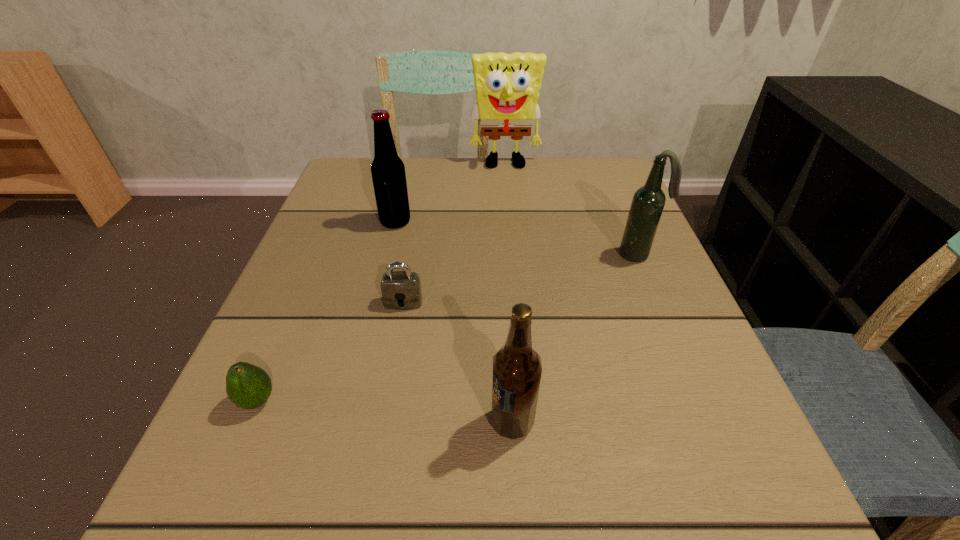
I want to click on empty space between the avocado and the nearest beer bottle, so click(x=385, y=411).

Where is `free point between the sponge and the second farthest beer bottle`? This screenshot has height=540, width=960. free point between the sponge and the second farthest beer bottle is located at coordinates (572, 210).

Locate an element on the screen. The image size is (960, 540). vacant region between the farthest object and the second beer bottle from left to right is located at coordinates (509, 293).

The image size is (960, 540). I want to click on vacant point located between the rightmost object and the second beer bottle from left to right, so click(575, 338).

Identify which object is located as the second nearest to the padlock. Please provide its 2D coordinates. Your answer should be formatted as a tuple, i.e. [(x, y)], where the tuple contains the x and y coordinates of a point satisfying the conditions above.

[(247, 386)]

At what (x,y) coordinates should I click in order to perform the action: click on object that is the second closest to the third nearest object. Please return your answer as a coordinate pair (x, y). Looking at the image, I should click on (247, 386).

At what (x,y) coordinates should I click in order to perform the action: click on beer bottle identified as the closest to the padlock. Please return your answer as a coordinate pair (x, y). Image resolution: width=960 pixels, height=540 pixels. Looking at the image, I should click on (388, 173).

At what (x,y) coordinates should I click in order to perform the action: click on the closest beer bottle to the leftmost beer bottle. Please return your answer as a coordinate pair (x, y). The image size is (960, 540). Looking at the image, I should click on (648, 202).

Where is `vacant point that satisfies the following two spatial constraints: 1. on the front side of the fifth nearest object; 2. on the right side of the rightmost object`? The image size is (960, 540). vacant point that satisfies the following two spatial constraints: 1. on the front side of the fifth nearest object; 2. on the right side of the rightmost object is located at coordinates (388, 254).

Identify the location of free space that satisfies the following two spatial constraints: 1. on the face of the rightmost beer bottle; 2. on the left side of the sponge. This screenshot has height=540, width=960. (514, 254).